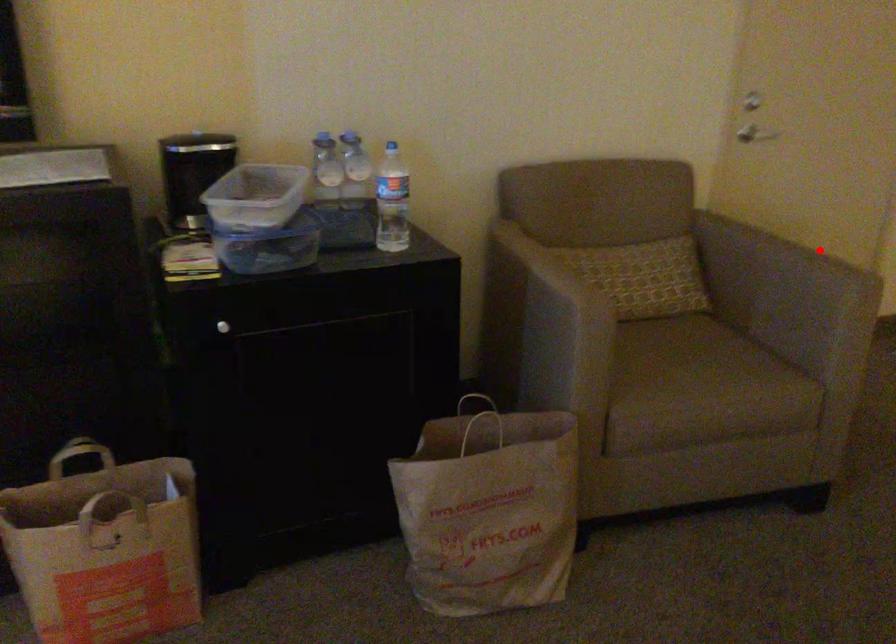
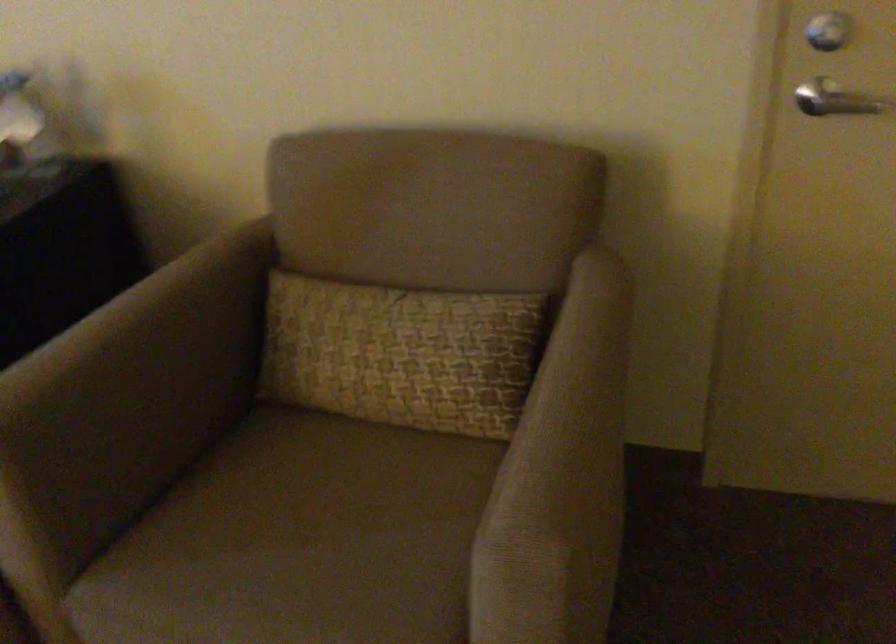
Question: A red point is marked in image1. In image2, is the corresponding 3D point closer to the camera or farther? Reply with the corresponding letter.

Choices:
 (A) The corresponding 3D point is closer.
 (B) The corresponding 3D point is farther.

Answer: (A)